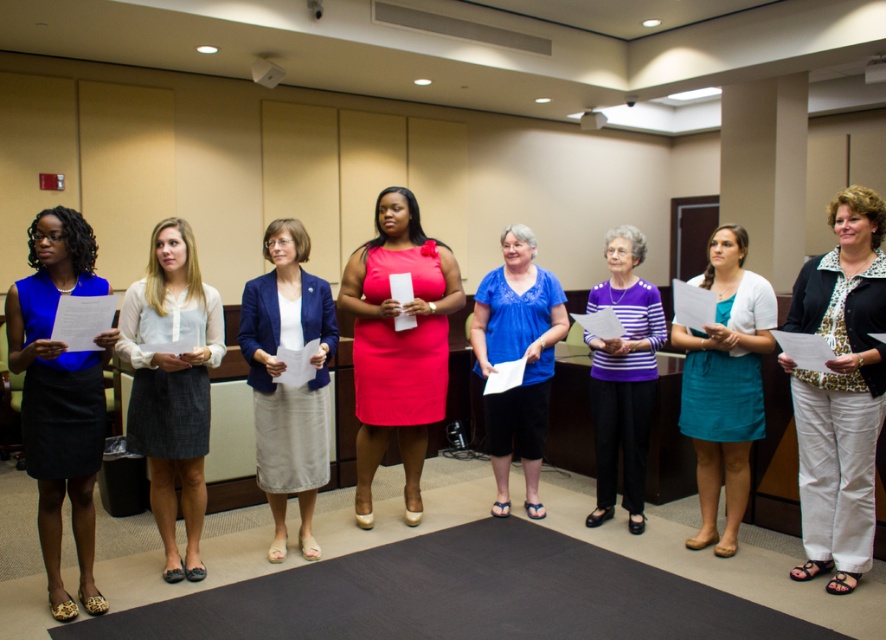
Question: Considering the relative positions of matte blue blouse at left and blue fabric blazer at center in the image provided, where is matte blue blouse at left located with respect to blue fabric blazer at center?

Choices:
 (A) left
 (B) right

Answer: (A)

Question: Which object appears farthest from the camera in this image?

Choices:
 (A) matte blue blouse at left
 (B) matte pink dress at center

Answer: (B)

Question: Is matte blue blouse at left further to the viewer compared to gray wool skirt at center?

Choices:
 (A) yes
 (B) no

Answer: (B)

Question: Is gray wool skirt at center to the right of blue sheer blouse at center from the viewer's perspective?

Choices:
 (A) no
 (B) yes

Answer: (A)

Question: Which of the following is the farthest from the observer?

Choices:
 (A) printed floral blouse at center
 (B) matte pink dress at center
 (C) purple striped sweater at center
 (D) gray wool skirt at center

Answer: (C)

Question: Which point appears farthest from the camera in this image?

Choices:
 (A) (179, 448)
 (B) (542, 396)
 (C) (429, 257)
 (D) (44, 307)

Answer: (B)